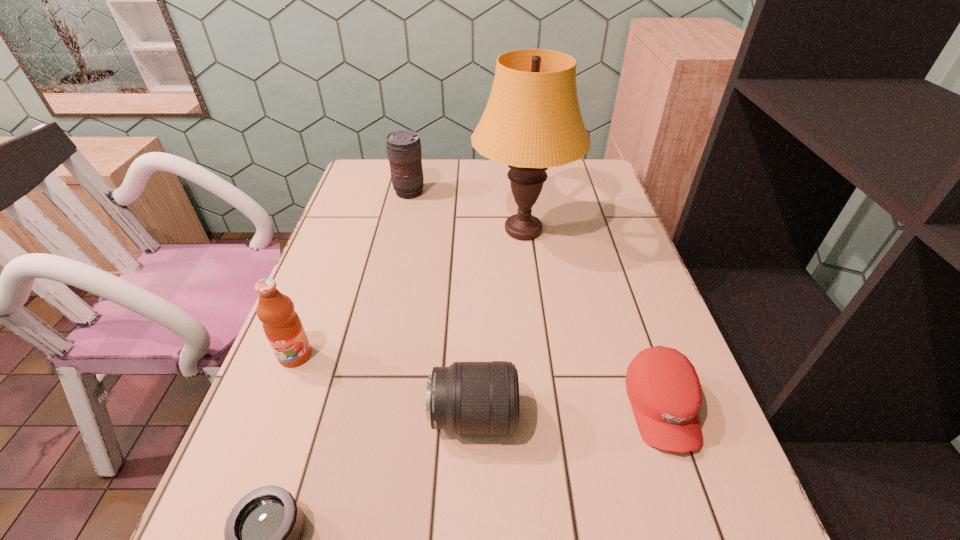
Locate an element on the screen. vacant space at the far edge is located at coordinates (475, 179).

In the image, there is a desktop. Where is `free region at the left edge`? The width and height of the screenshot is (960, 540). free region at the left edge is located at coordinates (308, 458).

The width and height of the screenshot is (960, 540). What are the coordinates of `free space at the right edge` in the screenshot? It's located at (580, 207).

Where is `vacant point at the far right corner`? This screenshot has height=540, width=960. vacant point at the far right corner is located at coordinates (x=580, y=166).

Image resolution: width=960 pixels, height=540 pixels. In order to click on unoccupied area between the lampshade and the rightmost object in this screenshot , I will do `click(592, 319)`.

Identify the location of empty location between the farthest telephoto lens and the rightmost object. Image resolution: width=960 pixels, height=540 pixels. (536, 300).

At what (x,y) coordinates should I click in order to perform the action: click on vacant space in between the farthest telephoto lens and the fruit juice. Please return your answer as a coordinate pair (x, y). Looking at the image, I should click on (352, 274).

The width and height of the screenshot is (960, 540). Identify the location of unoccupied position between the farthest telephoto lens and the fruit juice. (352, 274).

The width and height of the screenshot is (960, 540). In order to click on vacant region between the fruit juice and the second farthest object in this screenshot , I will do `click(409, 293)`.

The width and height of the screenshot is (960, 540). Find the location of `unoccupied area between the farthest object and the cap`. unoccupied area between the farthest object and the cap is located at coordinates (536, 300).